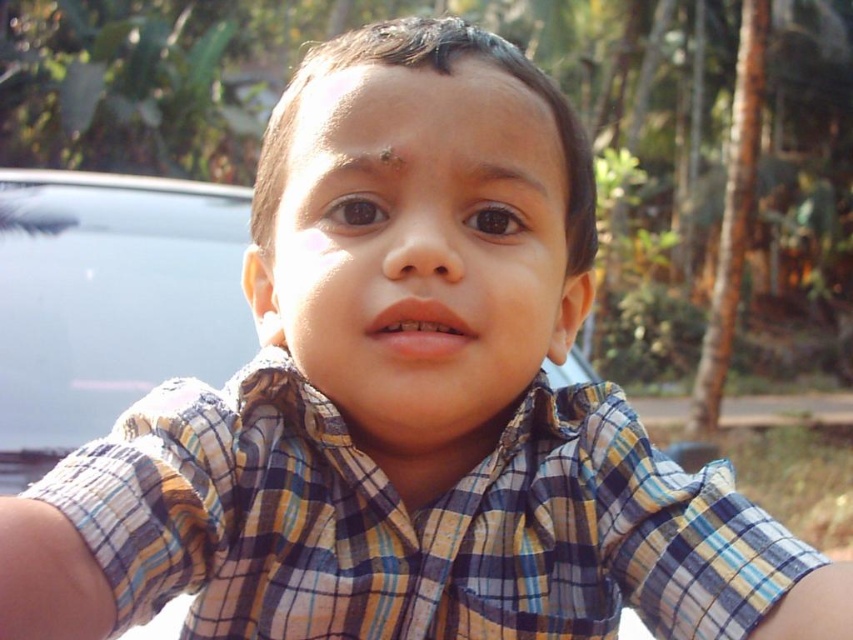
You are a photographer trying to capture the child in the plaid shirt at center and the metallic gray car at center. Which object is located to the right of the other?

The plaid shirt at center is positioned on the right side of metallic gray car at center, so the plaid shirt at center is to the right of the metallic gray car at center.

You are a photographer trying to capture the child in the scene. You notice the plaid shirt at center and the metallic gray car at center. Which object should you focus on if you want to ensure the subject is clearly visible in your photo?

The plaid shirt at center is thinner than the metallic gray car at center, so focusing on the plaid shirt at center would ensure the subject is clearly visible since it is closer to the camera.